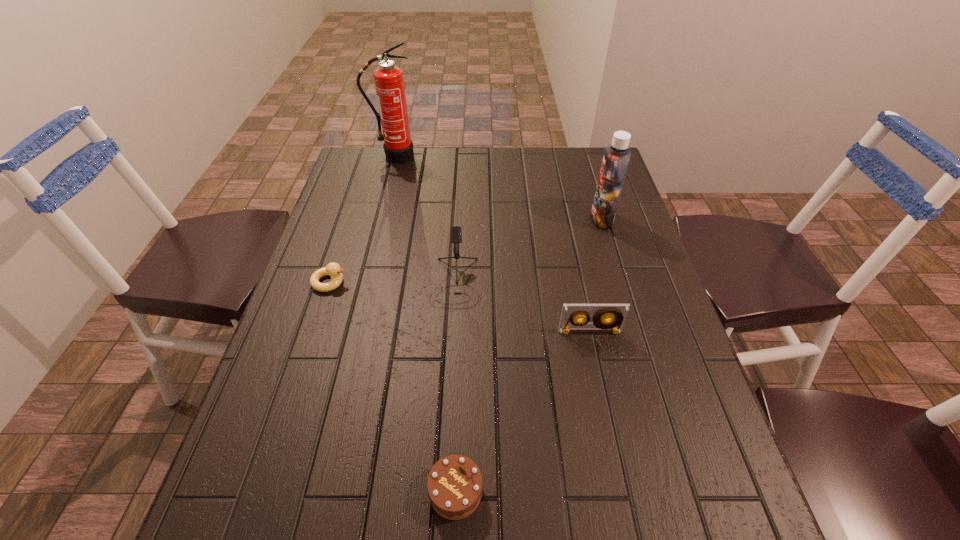
You are a GUI agent. You are given a task and a screenshot of the screen. Output one action in this format:
    pyautogui.click(x=<x>, y=<y>)
    Task: Click on the vacant space situated on the front label of the shampoo
    The image size is (960, 540).
    Given the screenshot: What is the action you would take?
    click(567, 219)

Image resolution: width=960 pixels, height=540 pixels. In order to click on vacant space located 0.050m on the front label of the shampoo in this screenshot , I will do `click(574, 219)`.

Find the location of `free space located 0.210m on the front label of the shampoo`. free space located 0.210m on the front label of the shampoo is located at coordinates (519, 219).

Identify the location of vacant space situated 0.370m on the stand of the third tallest object. (445, 465).

Where is `free spot located 0.120m at the front of the fourth tallest object with visible reels`? free spot located 0.120m at the front of the fourth tallest object with visible reels is located at coordinates (600, 381).

Locate an element on the screen. This screenshot has height=540, width=960. blank space located 0.370m on the right of the chocolate cake is located at coordinates (694, 491).

At what (x,y) coordinates should I click in order to perform the action: click on free space located 0.150m at the beak of the duckling. Please return your answer as a coordinate pair (x, y). Looking at the image, I should click on (407, 282).

Locate an element on the screen. This screenshot has width=960, height=540. object positioned at the far edge is located at coordinates (389, 83).

At what (x,y) coordinates should I click in order to perform the action: click on object that is at the near edge. Please return your answer as a coordinate pair (x, y). The height and width of the screenshot is (540, 960). Looking at the image, I should click on (454, 485).

Image resolution: width=960 pixels, height=540 pixels. Find the location of `fire extinguisher located at the left edge`. fire extinguisher located at the left edge is located at coordinates (389, 83).